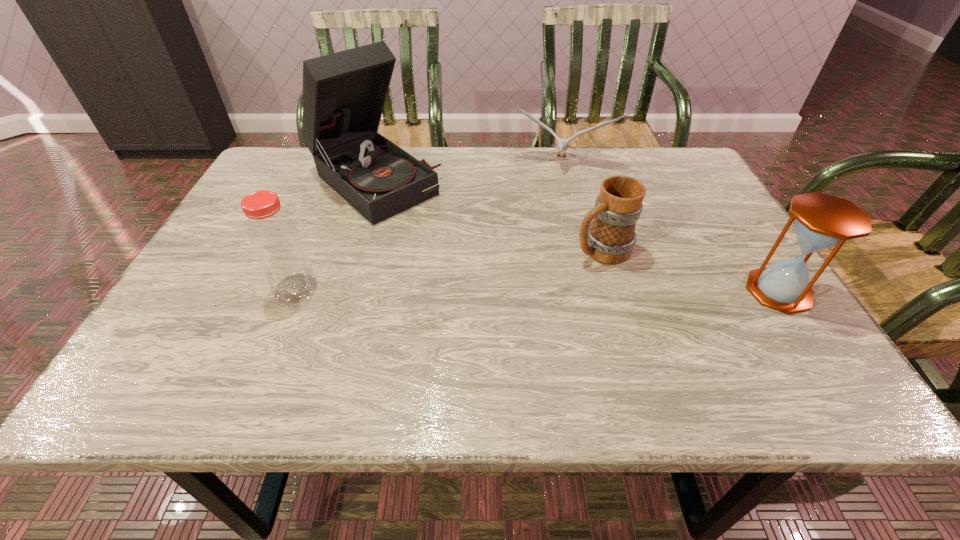
Locate an element on the screen. free spot between the hourglass and the bottle is located at coordinates (537, 289).

Where is `vacant area that lies between the bottle and the tallest object`? Image resolution: width=960 pixels, height=540 pixels. vacant area that lies between the bottle and the tallest object is located at coordinates (334, 235).

Image resolution: width=960 pixels, height=540 pixels. I want to click on empty location between the gull and the third nearest object, so click(x=580, y=206).

You are a GUI agent. You are given a task and a screenshot of the screen. Output one action in this format:
    pyautogui.click(x=<x>, y=<y>)
    Task: Click on the empty space that is in between the phonograph_record and the hourglass
    This screenshot has height=540, width=960.
    Given the screenshot: What is the action you would take?
    pyautogui.click(x=576, y=237)

The image size is (960, 540). What are the coordinates of `free spot between the third farthest object and the gull` in the screenshot? It's located at (580, 206).

Where is `unoccupied position between the bottle and the rightmost object`? unoccupied position between the bottle and the rightmost object is located at coordinates (537, 289).

The width and height of the screenshot is (960, 540). What are the coordinates of `vacant space that's between the bottle and the gull` in the screenshot? It's located at (427, 226).

Where is `object that stands as the third closest to the phonograph_record`? object that stands as the third closest to the phonograph_record is located at coordinates (610, 238).

Image resolution: width=960 pixels, height=540 pixels. I want to click on the second closest object relative to the gull, so click(x=610, y=238).

You are a GUI agent. You are given a task and a screenshot of the screen. Output one action in this format:
    pyautogui.click(x=<x>, y=<y>)
    Task: Click on the vacant space that satisfies the following two spatial constraints: 1. on the back side of the bottle; 2. on the left side of the third farthest object
    The height and width of the screenshot is (540, 960).
    Given the screenshot: What is the action you would take?
    pyautogui.click(x=311, y=249)